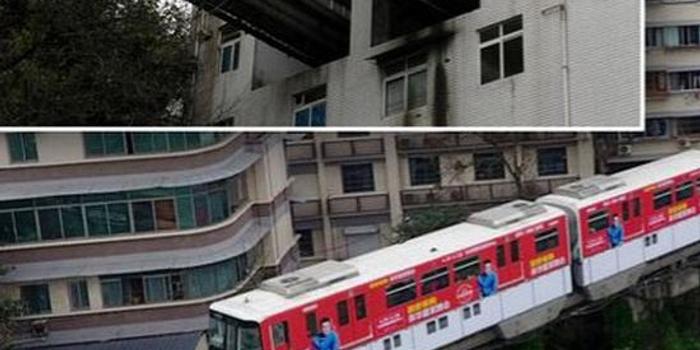
This screenshot has height=350, width=700. Find the location of `pillar`. pillar is located at coordinates (351, 50).